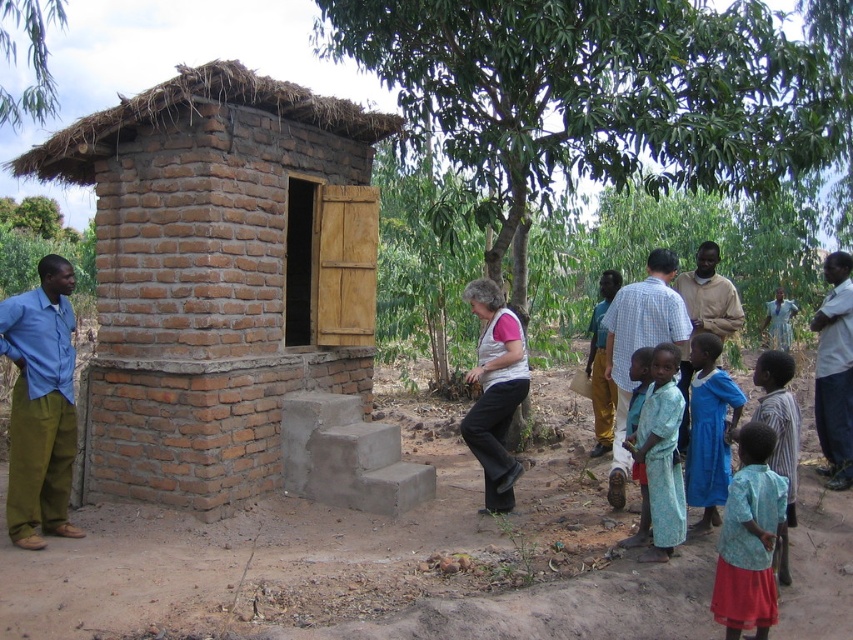
Identify the location of light blue checkered shirt at center. (639, 346).

Locate an element on the screen. The image size is (853, 640). light blue checkered shirt at center is located at coordinates (639, 346).

Who is taller, blue cotton shirt at lower right or blue cotton dress at lower right?

With more height is blue cotton shirt at lower right.

Is point (787, 540) farther from camera compared to point (641, 532)?

No, it is in front of (641, 532).

The width and height of the screenshot is (853, 640). I want to click on blue cotton shirt at lower right, so (x=780, y=436).

Looking at this image, does brown brick hut at left appear over light blue fabric dress at lower right?

Indeed, brown brick hut at left is positioned over light blue fabric dress at lower right.

Based on the photo, can you confirm if brown brick hut at left is bigger than light blue fabric dress at lower right?

Yes.

Is point (357, 188) farther from camera compared to point (674, 545)?

Yes, point (357, 188) is farther from viewer.

I want to click on brown brick hut at left, so [219, 275].